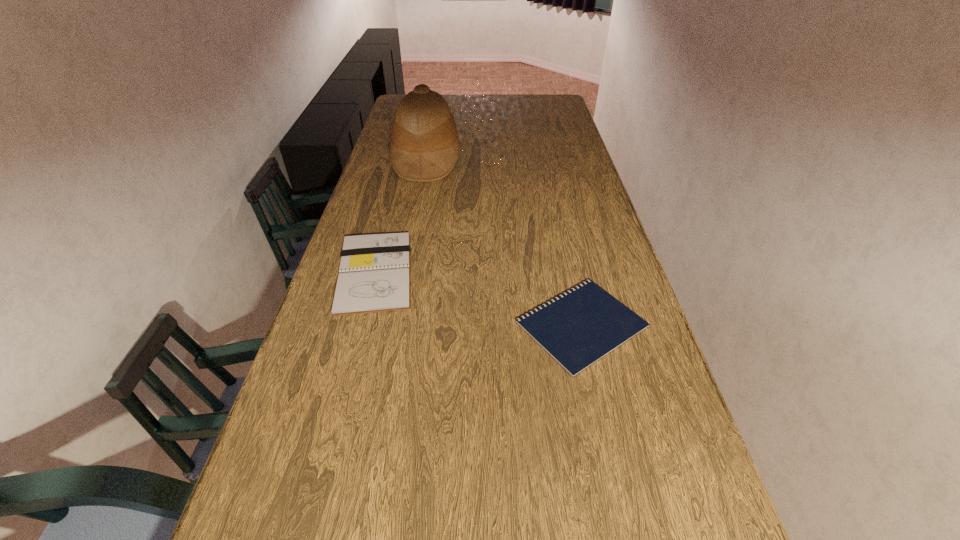
Locate an element on the screen. the tallest object is located at coordinates (424, 147).

This screenshot has width=960, height=540. Identify the location of hat. (424, 147).

This screenshot has height=540, width=960. Identify the location of the second shortest object. (374, 276).

Locate an element on the screen. the taller notepad is located at coordinates (374, 276).

At what (x,y) coordinates should I click in order to perform the action: click on the right notepad. Please return your answer as a coordinate pair (x, y). Image resolution: width=960 pixels, height=540 pixels. Looking at the image, I should click on (578, 328).

Image resolution: width=960 pixels, height=540 pixels. I want to click on the shortest object, so click(578, 328).

Where is `vacant point located on the front-facing side of the farthest object`? The image size is (960, 540). vacant point located on the front-facing side of the farthest object is located at coordinates (519, 160).

Identify the location of vacant space situated 0.220m on the back of the second tallest object. This screenshot has width=960, height=540. (395, 198).

You are a GUI agent. You are given a task and a screenshot of the screen. Output one action in this format:
    pyautogui.click(x=<x>, y=<y>)
    Task: Click on the free space located on the back of the rightmost object
    
    Given the screenshot: What is the action you would take?
    pyautogui.click(x=568, y=265)

You are a GUI agent. You are given a task and a screenshot of the screen. Output one action in this format:
    pyautogui.click(x=<x>, y=<y>)
    Task: Click on the hat situated at the left edge
    The image size is (960, 540).
    Given the screenshot: What is the action you would take?
    pyautogui.click(x=424, y=147)